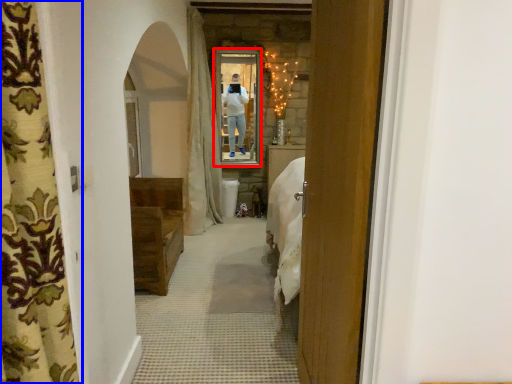
Question: Which object is closer to the camera taking this photo, mirror (highlighted by a red box) or curtain (highlighted by a blue box)?

Choices:
 (A) mirror
 (B) curtain

Answer: (B)